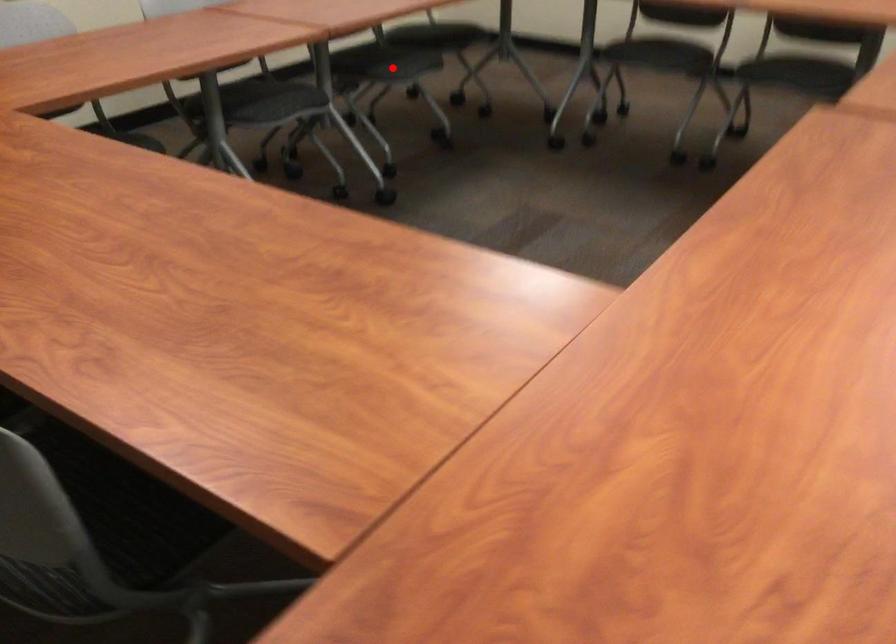
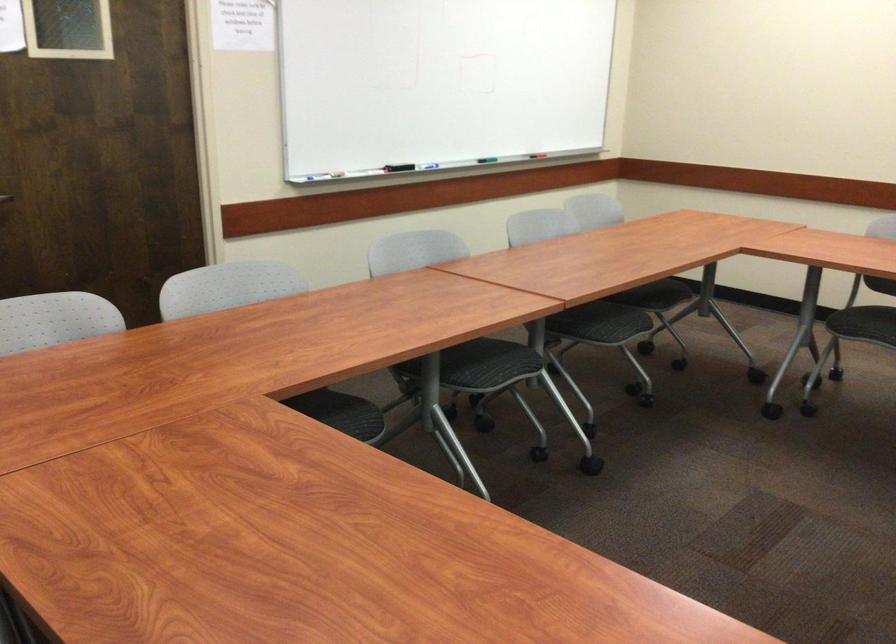
The point at the highlighted location is marked in the first image. Where is the corresponding point in the second image?

(583, 315)